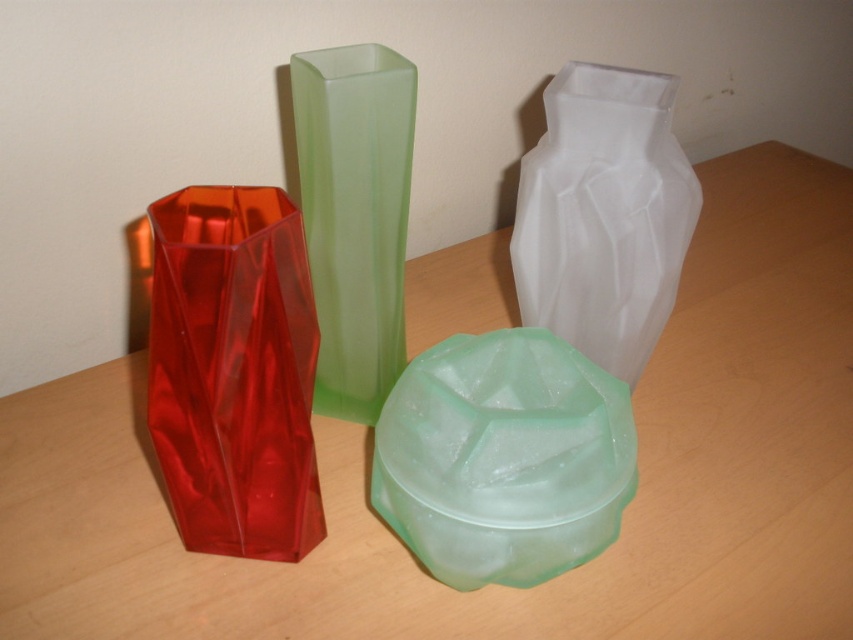
You are organizing a display and need to know the relative heights of the shiny red glass vase at left and the transparent frosted vase at center. Which one is taller?

The transparent frosted vase at center is taller than the shiny red glass vase at left.

You are arranging flowers for a centerpiece and have a bouquet that requires a vase wider than 10 inches. Looking at the image, can you determine if either the transparent frosted vase at center or the green frosted vase at center meets this requirement?

The transparent frosted vase at center might be wider than green frosted vase at center, but without specific measurements, it is uncertain if either exceeds 10 inches. Check the actual dimensions before deciding.

You are a delivery person who needs to place a new vase that is 16 inches wide between the shiny red glass vase at left and the transparent frosted vase at center. Is there enough space between them to fit the new vase?

The distance between the shiny red glass vase at left and the transparent frosted vase at center is 15.09 inches. Since the new vase is 16 inches wide, which is wider than the available space, it won not fit between them.